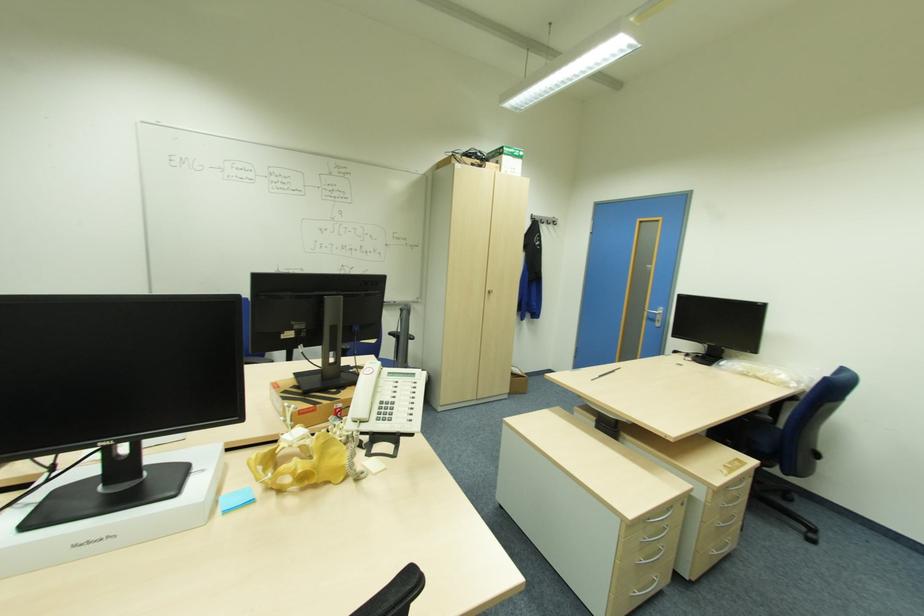
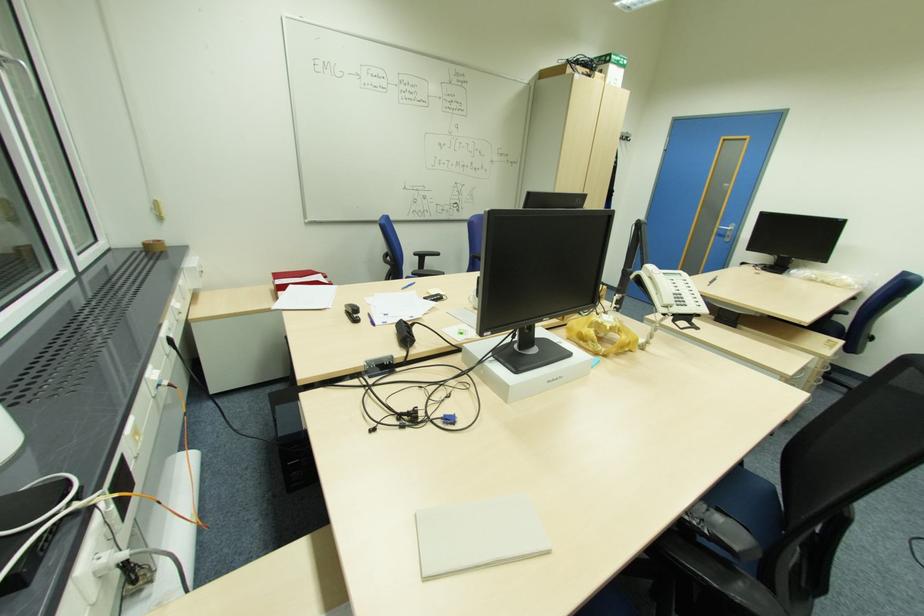
Question: The images are taken continuously from a first-person perspective. In which direction are you moving?

Choices:
 (A) Left
 (B) Right
 (C) Forward
 (D) Backward

Answer: (A)